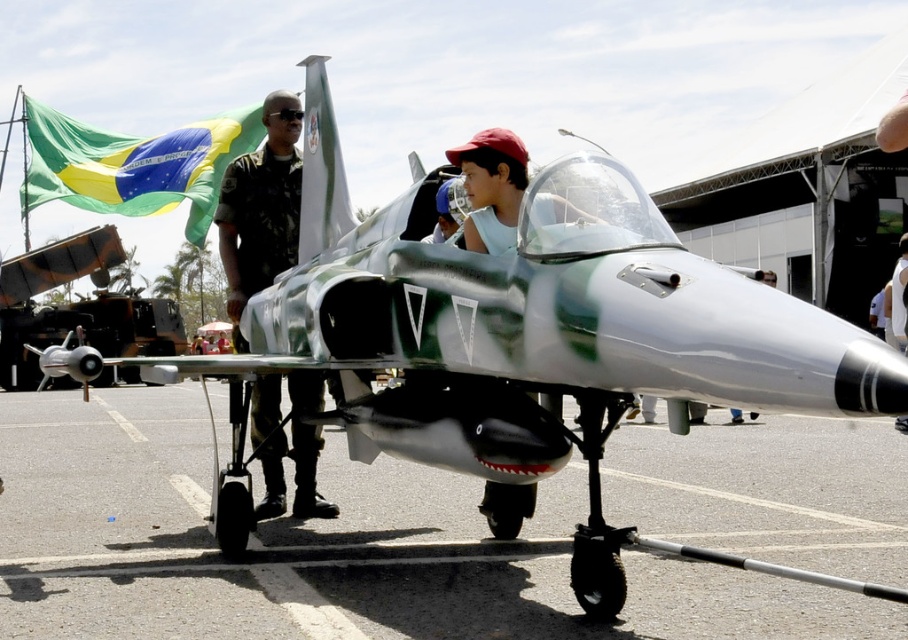
Question: Does camouflage uniform at center appear on the left side of green fabric flag at upper left?

Choices:
 (A) no
 (B) yes

Answer: (A)

Question: Is brushed metal tarmac at lower center further to the viewer compared to green fabric flag at upper left?

Choices:
 (A) no
 (B) yes

Answer: (A)

Question: Is brushed metal tarmac at lower center bigger than camouflage uniform at center?

Choices:
 (A) yes
 (B) no

Answer: (A)

Question: Among these objects, which one is farthest from the camera?

Choices:
 (A) camouflage uniform at center
 (B) brushed metal tarmac at lower center
 (C) green fabric flag at upper left

Answer: (C)

Question: Which point is farther from the camera taking this photo?

Choices:
 (A) (x=228, y=296)
 (B) (x=191, y=241)
 (C) (x=803, y=552)

Answer: (A)

Question: Among these points, which one is farthest from the camera?

Choices:
 (A) [x=245, y=128]
 (B) [x=216, y=221]
 (C) [x=822, y=564]

Answer: (A)